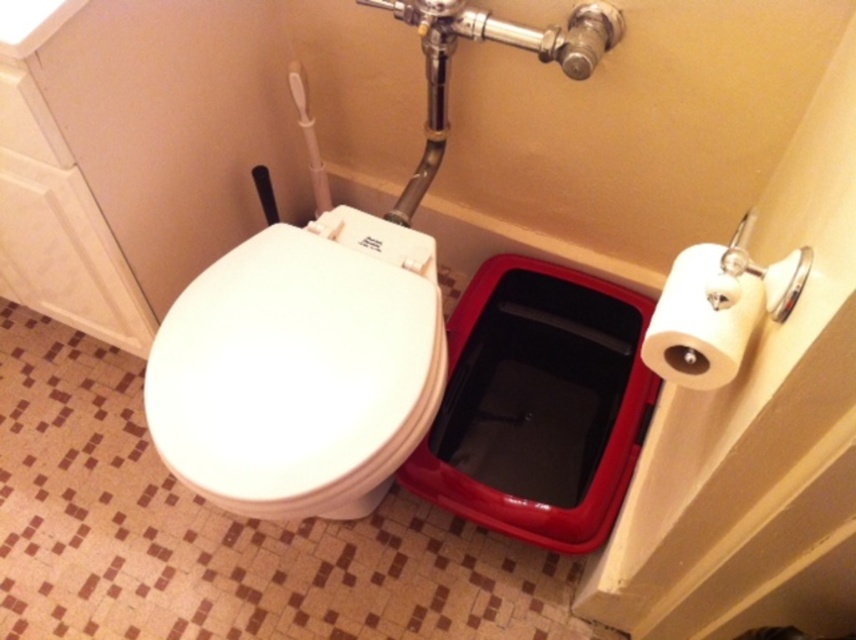
Can you confirm if white glossy toilet seat at center is positioned below white matte toilet paper at right?

Correct, white glossy toilet seat at center is located below white matte toilet paper at right.

Find the location of a particular element. white glossy toilet seat at center is located at coordinates (300, 368).